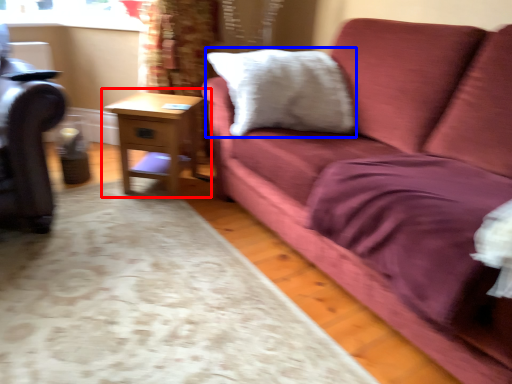
Question: Which object is further to the camera taking this photo, table (highlighted by a red box) or pillow (highlighted by a blue box)?

Choices:
 (A) table
 (B) pillow

Answer: (A)